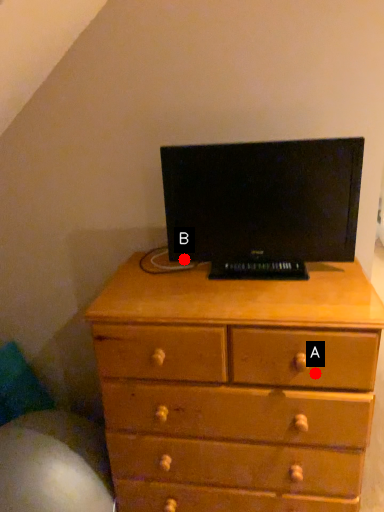
Question: Two points are circled on the image, labeled by A and B beside each circle. Among these points, which one is farthest from the camera?

Choices:
 (A) A is further
 (B) B is further

Answer: (B)